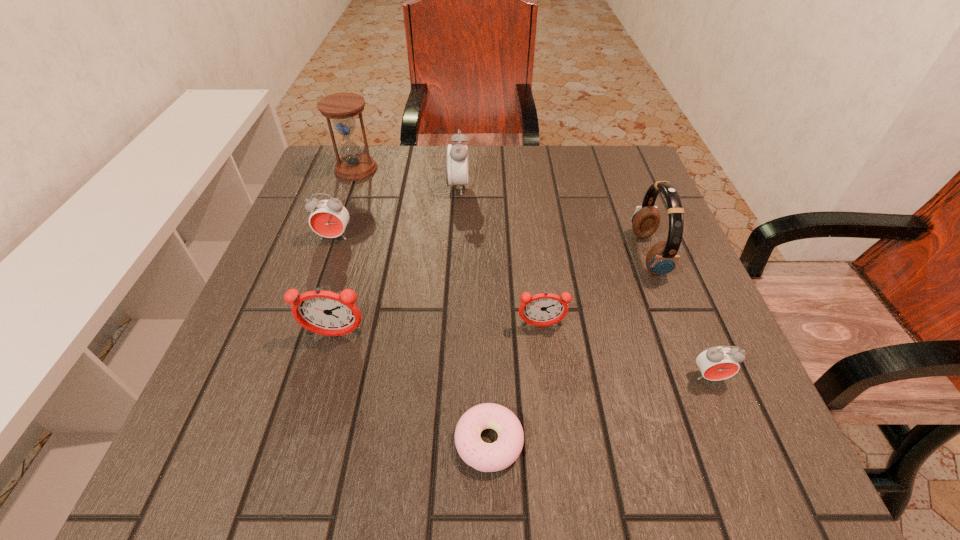
The width and height of the screenshot is (960, 540). I want to click on free space that is in between the pink doughnut and the bigger reddish-pink alarm clock, so click(x=412, y=388).

Where is `free space between the tallest alarm clock and the hourglass`? free space between the tallest alarm clock and the hourglass is located at coordinates (407, 178).

At what (x,y) coordinates should I click in order to perform the action: click on vacant area that lies between the pink doughnut and the nearest red alarm clock. Please return your answer as a coordinate pair (x, y). Image resolution: width=960 pixels, height=540 pixels. Looking at the image, I should click on (599, 409).

Find the location of a particular element. Image resolution: width=960 pixels, height=540 pixels. empty space that is in between the leftmost red alarm clock and the bigger reddish-pink alarm clock is located at coordinates (335, 286).

Locate an element on the screen. The width and height of the screenshot is (960, 540). empty space that is in between the fourth alarm clock from left to right and the hourglass is located at coordinates (448, 247).

Locate an element on the screen. empty space that is in between the brown headset and the hourglass is located at coordinates (502, 212).

In order to click on free point between the biggest red alarm clock and the right reddish-pink alarm clock in this screenshot , I will do `click(499, 256)`.

Identify which object is the sixth nearest to the brown headset. Please provide its 2D coordinates. Your answer should be formatted as a tuple, i.e. [(x, y)], where the tuple contains the x and y coordinates of a point satisfying the conditions above.

[(329, 217)]

The width and height of the screenshot is (960, 540). What are the coordinates of `object that is the fifth closest one to the tallest alarm clock` in the screenshot? It's located at point(327,313).

You are a GUI agent. You are given a task and a screenshot of the screen. Output one action in this format:
    pyautogui.click(x=<x>, y=<y>)
    Task: Click on the third closest alarm clock to the headset
    The height and width of the screenshot is (540, 960).
    Given the screenshot: What is the action you would take?
    pyautogui.click(x=456, y=159)